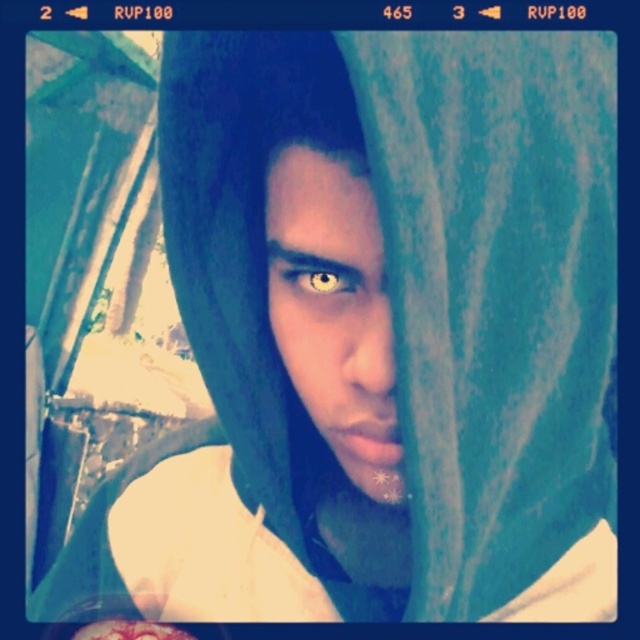
Question: Is matte skin face at center to the left of yellow matte eye at center from the viewer's perspective?

Choices:
 (A) yes
 (B) no

Answer: (B)

Question: Is matte skin face at center positioned at the back of yellow matte eye at center?

Choices:
 (A) no
 (B) yes

Answer: (A)

Question: Which object is closer to the camera taking this photo?

Choices:
 (A) matte skin face at center
 (B) yellow matte eye at center

Answer: (A)

Question: Does matte skin face at center have a lesser width compared to yellow matte eye at center?

Choices:
 (A) no
 (B) yes

Answer: (A)

Question: Which of the following is the farthest from the observer?

Choices:
 (A) yellow matte eye at center
 (B) matte skin face at center

Answer: (A)